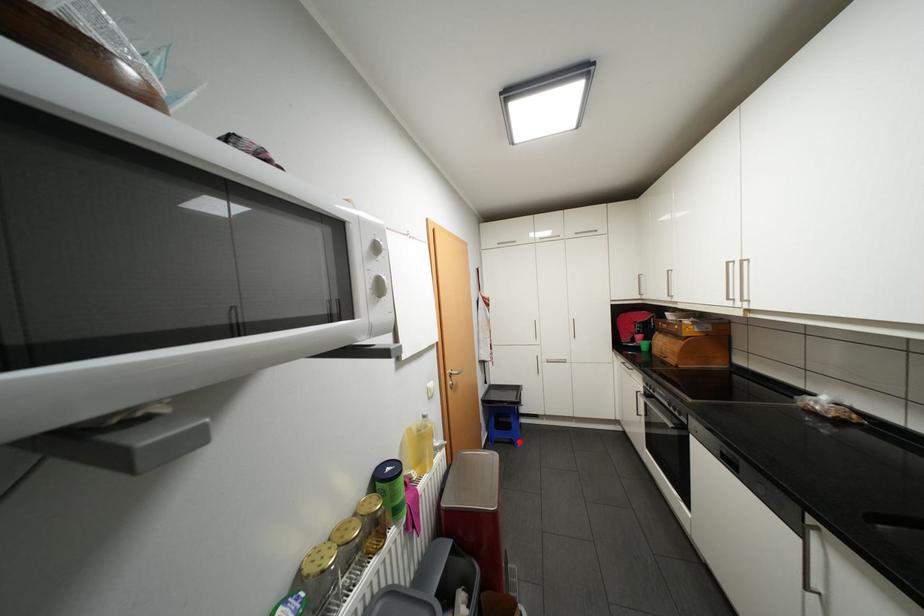
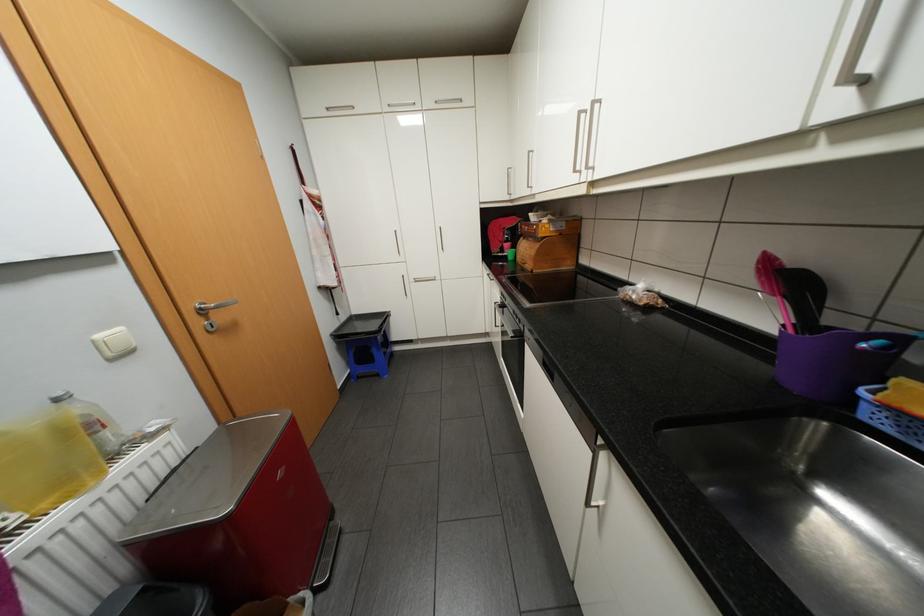
The point at the highlighted location is marked in the first image. Where is the corresponding point in the second image?

(385, 374)